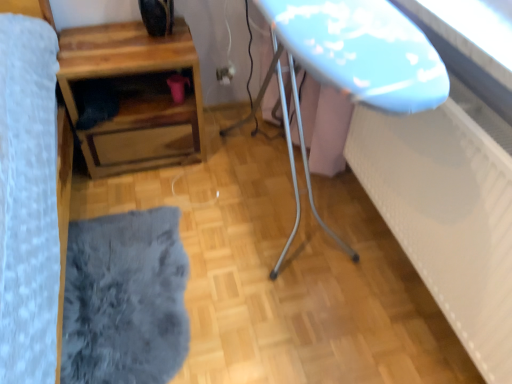
Question: Is matte plastic outlet at center positioned far away from fuzzy gray rug at lower left?

Choices:
 (A) yes
 (B) no

Answer: (A)

Question: Can you confirm if matte plastic outlet at center is bigger than fuzzy gray rug at lower left?

Choices:
 (A) no
 (B) yes

Answer: (A)

Question: Does matte plastic outlet at center contain fuzzy gray rug at lower left?

Choices:
 (A) no
 (B) yes

Answer: (A)

Question: Does matte plastic outlet at center touch fuzzy gray rug at lower left?

Choices:
 (A) no
 (B) yes

Answer: (A)

Question: From a real-world perspective, does matte plastic outlet at center sit lower than fuzzy gray rug at lower left?

Choices:
 (A) no
 (B) yes

Answer: (A)

Question: Is matte plastic outlet at center wider than fuzzy gray rug at lower left?

Choices:
 (A) no
 (B) yes

Answer: (A)

Question: Does wooden table at lower left appear on the right side of matte plastic outlet at center?

Choices:
 (A) no
 (B) yes

Answer: (A)

Question: From a real-world perspective, is wooden table at lower left positioned under matte plastic outlet at center based on gravity?

Choices:
 (A) yes
 (B) no

Answer: (B)

Question: Is wooden table at lower left wider than matte plastic outlet at center?

Choices:
 (A) yes
 (B) no

Answer: (A)

Question: Is wooden table at lower left beside matte plastic outlet at center?

Choices:
 (A) no
 (B) yes

Answer: (A)

Question: Does wooden table at lower left have a lesser width compared to matte plastic outlet at center?

Choices:
 (A) no
 (B) yes

Answer: (A)

Question: Is wooden table at lower left positioned with its back to matte plastic outlet at center?

Choices:
 (A) yes
 (B) no

Answer: (B)

Question: Is matte plastic outlet at center bigger than wooden table at lower left?

Choices:
 (A) no
 (B) yes

Answer: (A)